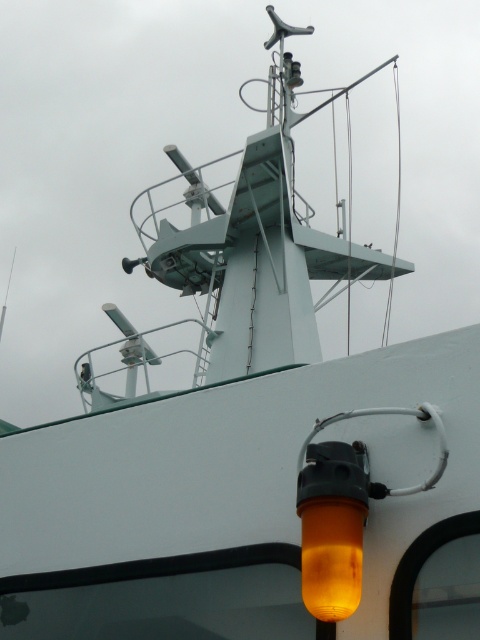
Question: Which object is farther from the camera taking this photo?

Choices:
 (A) orange translucent light at lower right
 (B) orange translucent lamp at lower right

Answer: (A)

Question: Does orange translucent lamp at lower right have a smaller size compared to orange translucent light at lower right?

Choices:
 (A) yes
 (B) no

Answer: (B)

Question: Can you confirm if orange translucent lamp at lower right is positioned to the left of orange translucent light at lower right?

Choices:
 (A) yes
 (B) no

Answer: (B)

Question: Can you confirm if orange translucent lamp at lower right is bigger than orange translucent light at lower right?

Choices:
 (A) no
 (B) yes

Answer: (B)

Question: Which point is closer to the camera?

Choices:
 (A) (351, 468)
 (B) (321, 596)

Answer: (B)